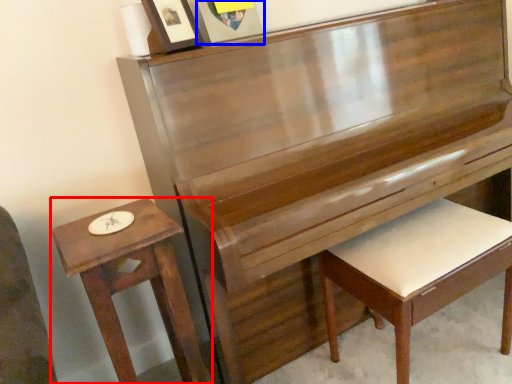
Question: Which object appears farthest to the camera in this image, table (highlighted by a red box) or picture frame (highlighted by a blue box)?

Choices:
 (A) table
 (B) picture frame

Answer: (B)